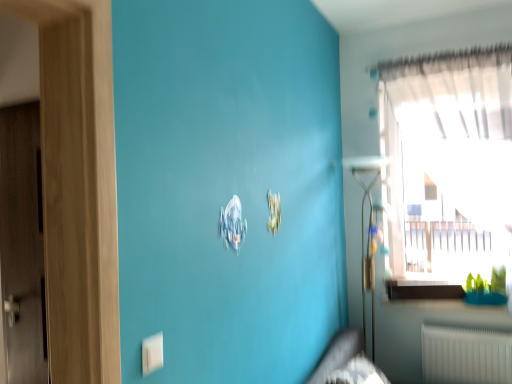
Question: From a real-world perspective, is white plastic electric outlet at lower left on white glossy window sill at lower right?

Choices:
 (A) no
 (B) yes

Answer: (B)

Question: Is white plastic electric outlet at lower left taller than white glossy window sill at lower right?

Choices:
 (A) no
 (B) yes

Answer: (A)

Question: Does white plastic electric outlet at lower left touch white glossy window sill at lower right?

Choices:
 (A) yes
 (B) no

Answer: (B)

Question: Can you confirm if white plastic electric outlet at lower left is bigger than white glossy window sill at lower right?

Choices:
 (A) yes
 (B) no

Answer: (B)

Question: From the image's perspective, does white plastic electric outlet at lower left appear lower than white glossy window sill at lower right?

Choices:
 (A) yes
 (B) no

Answer: (B)

Question: Does point (485, 48) appear closer or farther from the camera than point (362, 354)?

Choices:
 (A) farther
 (B) closer

Answer: (A)

Question: From a real-world perspective, relative to dark gray fabric bed frame at lower center, is transparent glass window at upper right vertically above or below?

Choices:
 (A) above
 (B) below

Answer: (A)

Question: Relative to dark gray fabric bed frame at lower center, is transparent glass window at upper right in front or behind?

Choices:
 (A) front
 (B) behind

Answer: (B)

Question: Is transparent glass window at upper right to the left or to the right of dark gray fabric bed frame at lower center in the image?

Choices:
 (A) right
 (B) left

Answer: (A)

Question: From the image's perspective, is white plastic electric outlet at lower left located above or below transparent glass window at upper right?

Choices:
 (A) below
 (B) above

Answer: (A)

Question: Is point (154, 339) closer or farther from the camera than point (497, 180)?

Choices:
 (A) closer
 (B) farther

Answer: (A)

Question: From a real-world perspective, is white plastic electric outlet at lower left above or below transparent glass window at upper right?

Choices:
 (A) above
 (B) below

Answer: (B)

Question: Relative to transparent glass window at upper right, is white plastic electric outlet at lower left in front or behind?

Choices:
 (A) front
 (B) behind

Answer: (A)

Question: From their relative heights in the image, would you say white glossy window sill at lower right is taller or shorter than white plastic electric outlet at lower left?

Choices:
 (A) tall
 (B) short

Answer: (A)

Question: Is point (404, 284) closer or farther from the camera than point (159, 347)?

Choices:
 (A) farther
 (B) closer

Answer: (A)